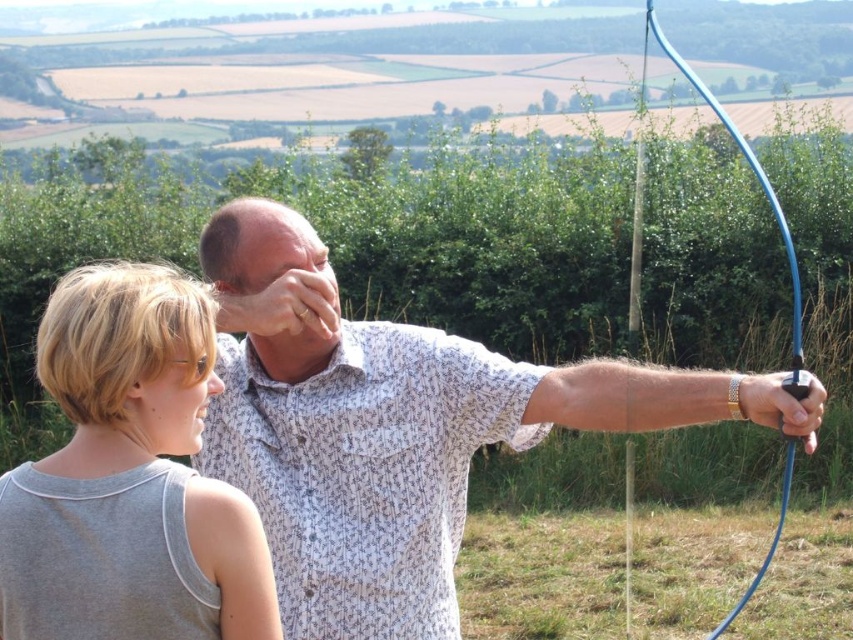
You are a photographer standing at the camera position. You want to take a photo of the gray fabric shirt at upper left. Is the shirt within the camera range of 2 meters?

The gray fabric shirt at upper left and camera are 2.11 meters apart, so the shirt is slightly out of the camera range of 2 meters.

You are an observer standing in front of the scene. You notice the gray fabric shirt at upper left and the blue rubber bow at right. Which object takes up more visual space in the image?

The blue rubber bow at right takes up more visual space than the gray fabric shirt at upper left because the gray fabric shirt at upper left occupies less space than blue rubber bow at right.